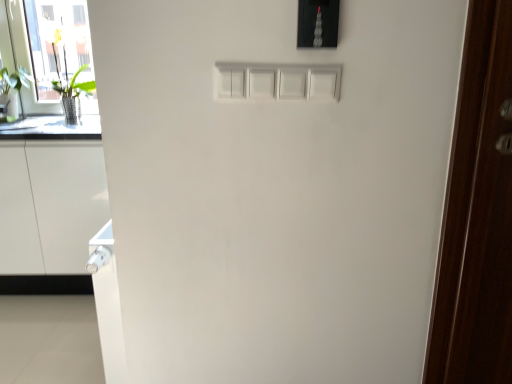
Question: Considering the relative sizes of dark wood door at right and satin black light switch at upper center in the image provided, is dark wood door at right taller than satin black light switch at upper center?

Choices:
 (A) no
 (B) yes

Answer: (B)

Question: Is dark wood door at right far away from satin black light switch at upper center?

Choices:
 (A) yes
 (B) no

Answer: (B)

Question: From the image's perspective, would you say dark wood door at right is positioned over satin black light switch at upper center?

Choices:
 (A) yes
 (B) no

Answer: (B)

Question: From a real-world perspective, is dark wood door at right physically below satin black light switch at upper center?

Choices:
 (A) yes
 (B) no

Answer: (A)

Question: Can you confirm if dark wood door at right is positioned to the left of satin black light switch at upper center?

Choices:
 (A) yes
 (B) no

Answer: (B)

Question: From their relative heights in the image, would you say green leafy plant at left is taller or shorter than white glossy cabinet at lower left?

Choices:
 (A) tall
 (B) short

Answer: (B)

Question: From the image's perspective, is green leafy plant at left above or below white glossy cabinet at lower left?

Choices:
 (A) below
 (B) above

Answer: (B)

Question: Choose the correct answer: Is green leafy plant at left inside white glossy cabinet at lower left or outside it?

Choices:
 (A) inside
 (B) outside

Answer: (B)

Question: Relative to white glossy cabinet at lower left, is green leafy plant at left in front or behind?

Choices:
 (A) behind
 (B) front

Answer: (A)

Question: Is point coord(70,81) positioned closer to the camera than point coord(6,241)?

Choices:
 (A) closer
 (B) farther

Answer: (B)

Question: Based on their sizes in the image, would you say transparent glass door at left is bigger or smaller than white glossy cabinet at lower left?

Choices:
 (A) big
 (B) small

Answer: (B)

Question: Looking at their shapes, would you say transparent glass door at left is wider or thinner than white glossy cabinet at lower left?

Choices:
 (A) thin
 (B) wide

Answer: (A)

Question: From a real-world perspective, relative to white glossy cabinet at lower left, is transparent glass door at left vertically above or below?

Choices:
 (A) below
 (B) above

Answer: (B)

Question: From their relative heights in the image, would you say dark wood door at right is taller or shorter than transparent glass door at left?

Choices:
 (A) short
 (B) tall

Answer: (B)

Question: From the image's perspective, relative to transparent glass door at left, is dark wood door at right above or below?

Choices:
 (A) below
 (B) above

Answer: (A)